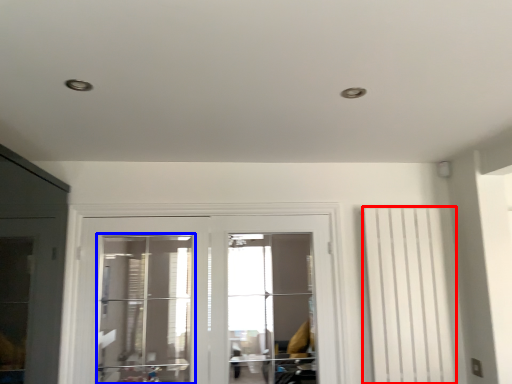
Question: Which of the following is the closest to the observer, curtain (highlighted by a red box) or window (highlighted by a blue box)?

Choices:
 (A) curtain
 (B) window

Answer: (B)